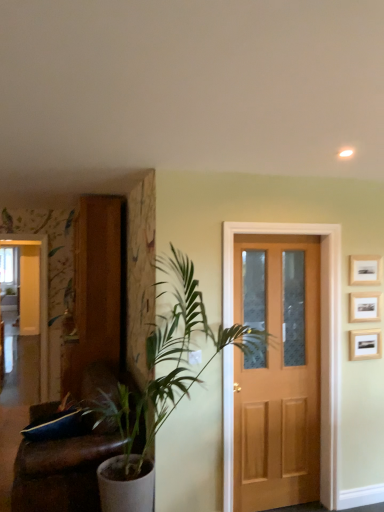
Question: From a real-world perspective, is wooden picture frame at upper right, placed as the second picture frame when sorted from top to bottom, on wooden picture frame at upper right, the 3th picture frame from the bottom?

Choices:
 (A) yes
 (B) no

Answer: (B)

Question: From the image's perspective, would you say wooden picture frame at upper right, which ranks as the 2th picture frame in bottom-to-top order, is positioned over wooden picture frame at upper right, the 3th picture frame from the bottom?

Choices:
 (A) no
 (B) yes

Answer: (A)

Question: Considering the relative sizes of wooden picture frame at upper right, which ranks as the 2th picture frame in bottom-to-top order, and wooden picture frame at upper right, the 3th picture frame from the bottom, in the image provided, is wooden picture frame at upper right, which ranks as the 2th picture frame in bottom-to-top order, shorter than wooden picture frame at upper right, the 3th picture frame from the bottom,?

Choices:
 (A) yes
 (B) no

Answer: (B)

Question: Is wooden picture frame at upper right, placed as the second picture frame when sorted from top to bottom, at the right side of wooden picture frame at upper right, the 1th picture frame when ordered from top to bottom?

Choices:
 (A) no
 (B) yes

Answer: (A)

Question: Is wooden picture frame at upper right, which ranks as the 2th picture frame in bottom-to-top order, next to wooden picture frame at upper right, the 3th picture frame from the bottom, and touching it?

Choices:
 (A) yes
 (B) no

Answer: (B)

Question: Considering the relative positions of green leafy plant at left and white glossy elevator at left in the image provided, is green leafy plant at left to the left or to the right of white glossy elevator at left?

Choices:
 (A) left
 (B) right

Answer: (B)

Question: Is green leafy plant at left spatially inside white glossy elevator at left, or outside of it?

Choices:
 (A) inside
 (B) outside

Answer: (B)

Question: Is green leafy plant at left wider or thinner than white glossy elevator at left?

Choices:
 (A) wide
 (B) thin

Answer: (A)

Question: Does point pos(135,432) appear closer or farther from the camera than point pos(43,355)?

Choices:
 (A) closer
 (B) farther

Answer: (A)

Question: Relative to brown leather couch at left, is wooden picture frame at upper right, arranged as the first picture frame when ordered from the bottom, in front or behind?

Choices:
 (A) front
 (B) behind

Answer: (B)

Question: Looking at their shapes, would you say wooden picture frame at upper right, arranged as the first picture frame when ordered from the bottom, is wider or thinner than brown leather couch at left?

Choices:
 (A) wide
 (B) thin

Answer: (B)

Question: Is wooden picture frame at upper right, the 3th picture frame viewed from the top, taller or shorter than brown leather couch at left?

Choices:
 (A) tall
 (B) short

Answer: (B)

Question: Considering the positions of wooden picture frame at upper right, the 3th picture frame viewed from the top, and brown leather couch at left in the image, is wooden picture frame at upper right, the 3th picture frame viewed from the top, bigger or smaller than brown leather couch at left?

Choices:
 (A) big
 (B) small

Answer: (B)

Question: Considering their positions, is wooden picture frame at upper right, the 3th picture frame viewed from the top, located in front of or behind white glossy elevator at left?

Choices:
 (A) behind
 (B) front

Answer: (B)

Question: From the image's perspective, is wooden picture frame at upper right, arranged as the first picture frame when ordered from the bottom, located above or below white glossy elevator at left?

Choices:
 (A) below
 (B) above

Answer: (B)